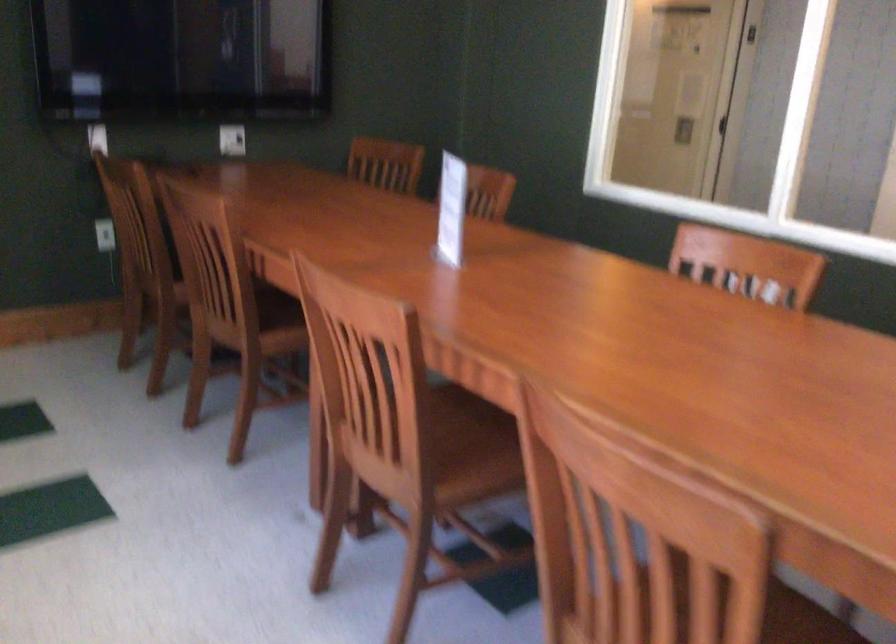
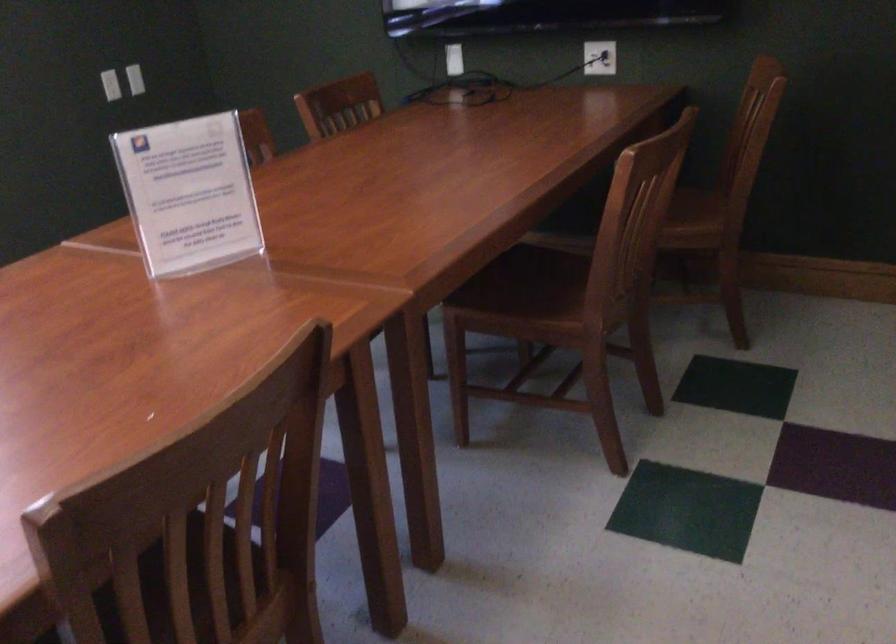
The point at (x=245, y=136) is marked in the first image. Where is the corresponding point in the second image?

(599, 58)